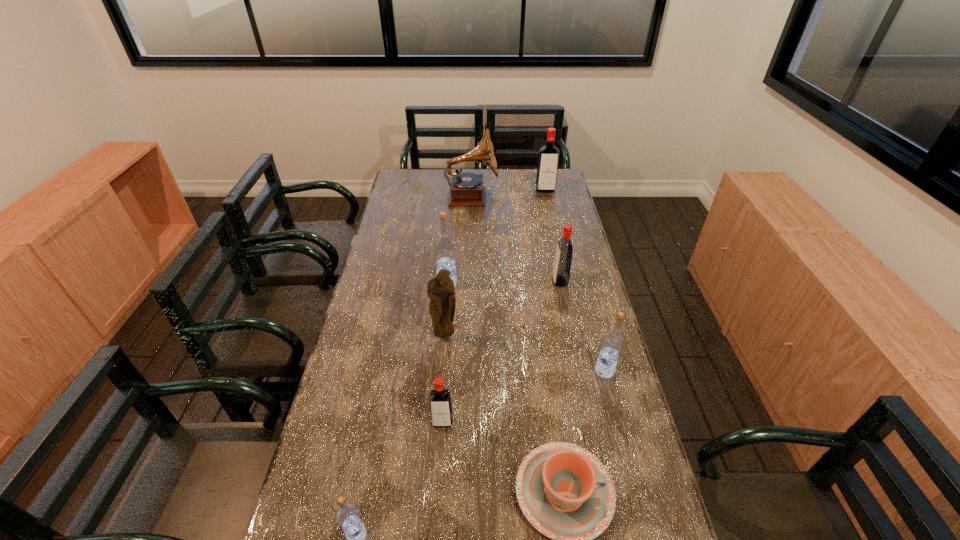
At what (x,y) coordinates should I click in order to perform the action: click on free spot that satisfies the following two spatial constraints: 1. on the front and back of the second nearest red vodka; 2. on the front side of the farthest blue vodka. Please return your answer as a coordinate pair (x, y). Image resolution: width=960 pixels, height=540 pixels. Looking at the image, I should click on (561, 284).

You are a GUI agent. You are given a task and a screenshot of the screen. Output one action in this format:
    pyautogui.click(x=<x>, y=<y>)
    Task: Click on the free location that satisfies the following two spatial constraints: 1. on the front and back of the farthest vodka; 2. on the front and back of the second smallest red vodka
    
    Given the screenshot: What is the action you would take?
    pyautogui.click(x=565, y=281)